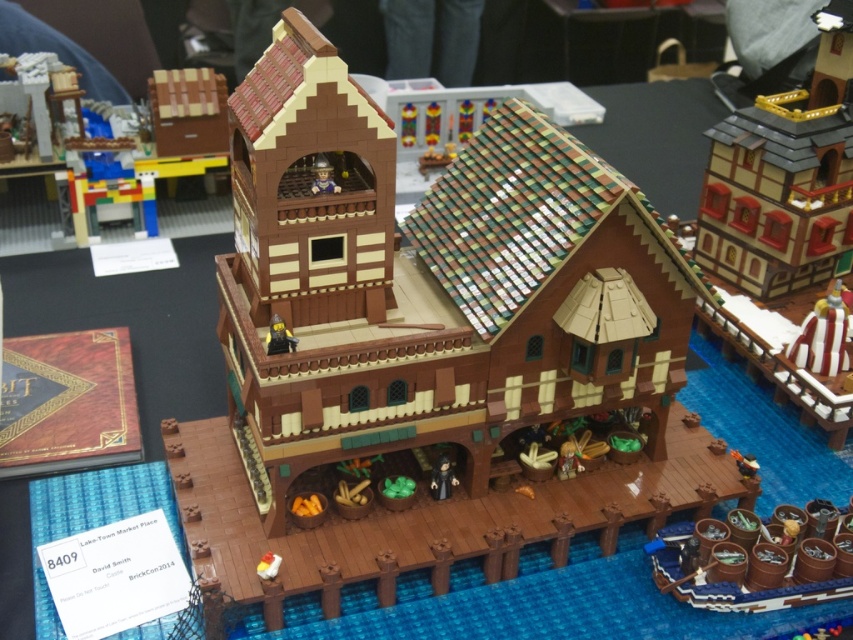
Between point (276, 339) and point (335, 193), which one is positioned in front?

Point (276, 339)

Can you confirm if matte brown minifigure at center is shorter than matte brown minifigure at upper center?

Correct, matte brown minifigure at center is not as tall as matte brown minifigure at upper center.

Which is in front, point (279, 326) or point (318, 170)?

Point (279, 326)

Locate an element on the screen. The height and width of the screenshot is (640, 853). matte brown minifigure at center is located at coordinates (279, 337).

Does brown wood building at center have a lesser width compared to smooth black figure at lower center?

No.

Which is more to the right, brown wood building at center or smooth black figure at lower center?

brown wood building at center

Who is more distant from viewer, (x=392, y=236) or (x=434, y=484)?

The point (x=434, y=484) is behind.

Locate an element on the screen. brown wood building at center is located at coordinates (426, 342).

Does smooth black figure at lower center have a lesser width compared to matte brown minifigure at center?

Indeed, smooth black figure at lower center has a lesser width compared to matte brown minifigure at center.

Which is above, smooth black figure at lower center or matte brown minifigure at center?

matte brown minifigure at center

This screenshot has height=640, width=853. Find the location of `smooth black figure at lower center`. smooth black figure at lower center is located at coordinates (442, 477).